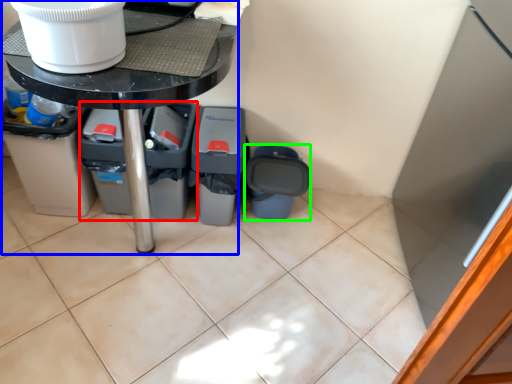
Question: Which object is positioned closest to bin (highlighted by a red box)? Select from table (highlighted by a blue box) and recycling bin (highlighted by a green box).

Choices:
 (A) table
 (B) recycling bin

Answer: (B)